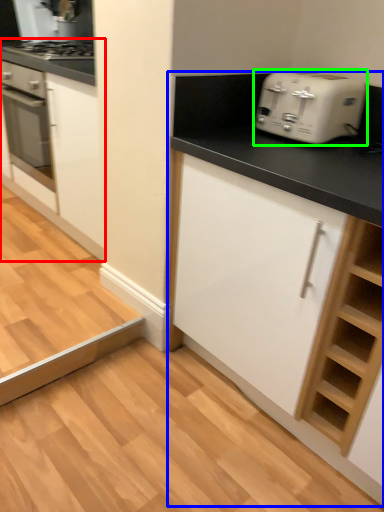
Question: Which object is positioned farthest from cabinetry (highlighted by a red box)? Select from cabinetry (highlighted by a blue box) and toaster (highlighted by a green box).

Choices:
 (A) cabinetry
 (B) toaster

Answer: (B)